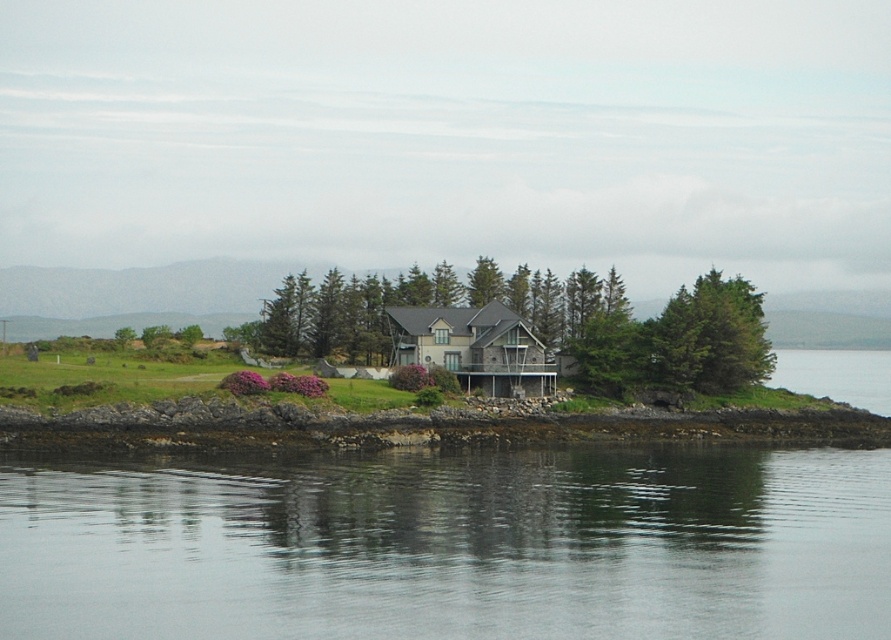
Can you confirm if green textured house at center is bigger than rugged stone shoreline at lower left?

Yes.

Can you confirm if green textured house at center is thinner than rugged stone shoreline at lower left?

Yes, green textured house at center is thinner than rugged stone shoreline at lower left.

Is point (671, 310) behind point (324, 413)?

Yes, point (671, 310) is farther from viewer.

Where is `green textured house at center`? This screenshot has height=640, width=891. green textured house at center is located at coordinates (534, 328).

Does rugged stone shoreline at lower left come behind green textured tree at upper right?

That is False.

From the picture: Can you confirm if rugged stone shoreline at lower left is positioned above green textured tree at upper right?

Incorrect, rugged stone shoreline at lower left is not positioned above green textured tree at upper right.

Where is `rugged stone shoreline at lower left`? This screenshot has height=640, width=891. rugged stone shoreline at lower left is located at coordinates (426, 426).

From the picture: Which is below, green textured house at center or green textured tree at upper right?

green textured house at center

From the picture: Which is more to the right, green textured house at center or green textured tree at upper right?

green textured tree at upper right is more to the right.

You are a GUI agent. You are given a task and a screenshot of the screen. Output one action in this format:
    pyautogui.click(x=<x>, y=<y>)
    Task: Click on the green textured house at center
    
    Given the screenshot: What is the action you would take?
    pyautogui.click(x=534, y=328)